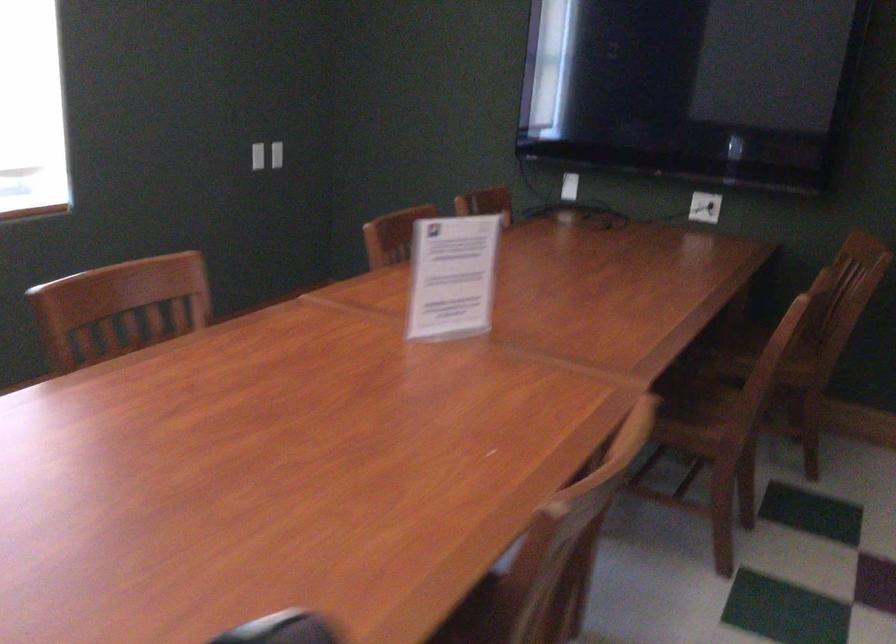
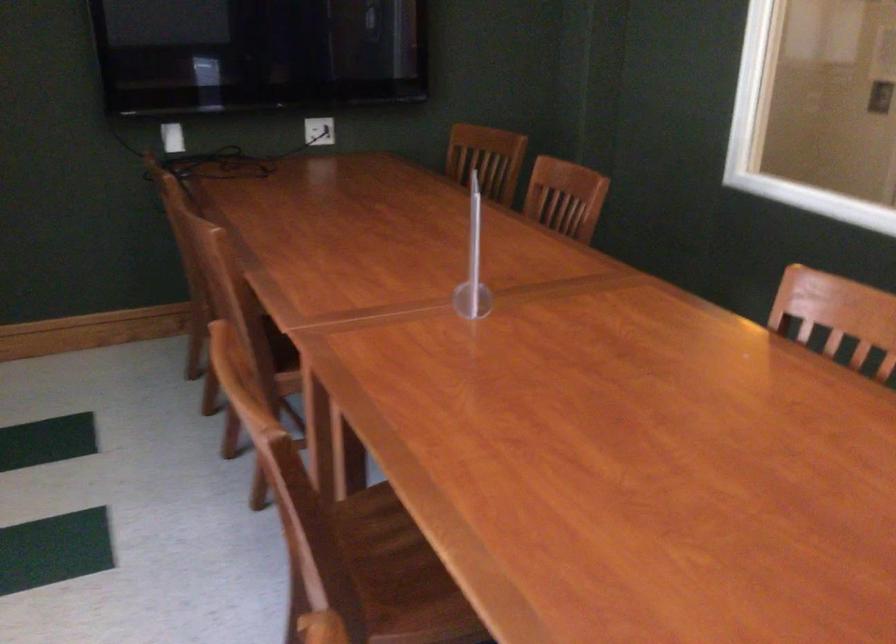
Find the pixel in the second image that matches the point at 626,469 in the first image.

(841, 313)